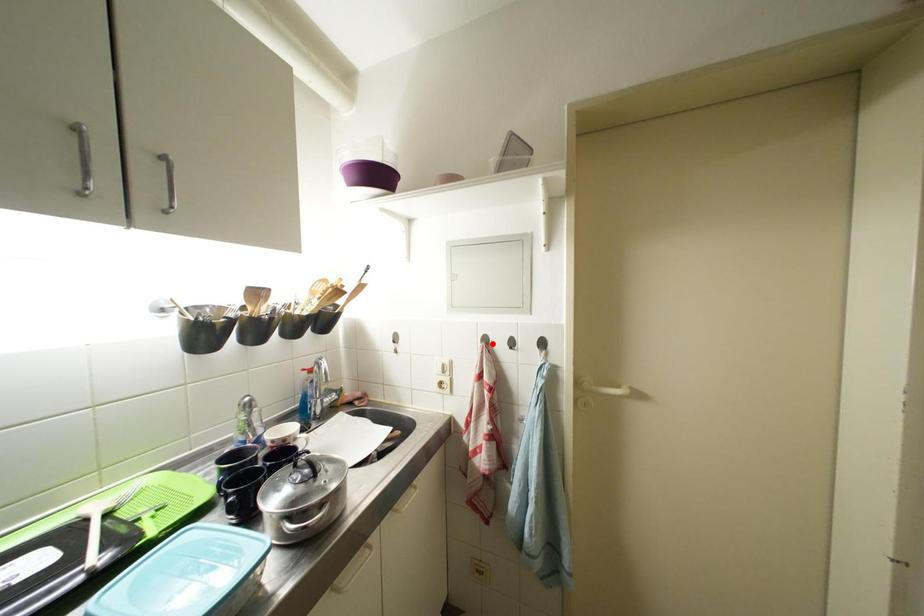
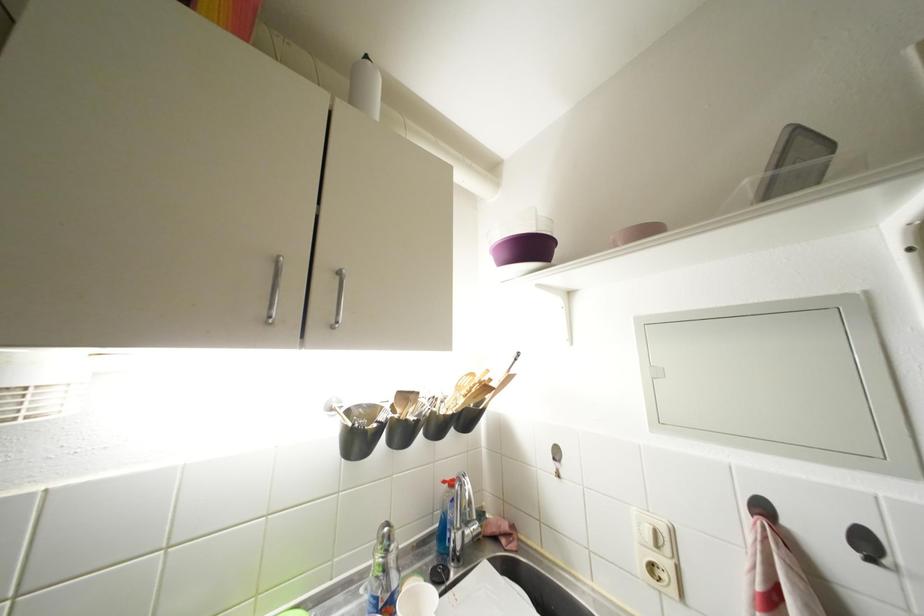
Find the pixel in the second image that matches the highlighted location in the first image.

(770, 513)